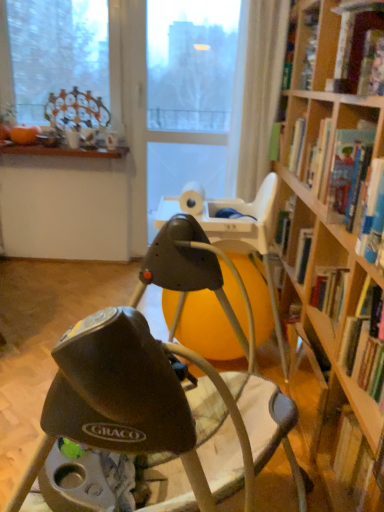
Measure the distance between transparent plastic screen door at center and camera.

2.35 meters.

Describe the element at coordinates (349, 170) in the screenshot. This screenshot has width=384, height=512. I see `hardcover book at upper right, the 2th book from the top` at that location.

Locate an element on the screen. hardcover book at right, which is the 3th book in top-to-bottom order is located at coordinates (365, 343).

This screenshot has width=384, height=512. Identify the location of the 1st book below when counting from the transparent plastic screen door at center (from the image's perspective). (354, 40).

Looking at this image, between transparent plastic screen door at center and hardcover book at upper right, which is counted as the 3th book, starting from the bottom, which one appears on the left side from the viewer's perspective?

transparent plastic screen door at center is more to the left.

In the scene shown: Between transparent plastic screen door at center and hardcover book at upper right, which is counted as the 3th book, starting from the bottom, which one has smaller width?

transparent plastic screen door at center is thinner.

Who is smaller, matte black baby swing at center or hardcover book at right, which is the first book from bottom to top?

With smaller size is hardcover book at right, which is the first book from bottom to top.

Where is `the 2nd book to the right when counting from the matte black baby swing at center`? The width and height of the screenshot is (384, 512). the 2nd book to the right when counting from the matte black baby swing at center is located at coordinates (365, 343).

From the image's perspective, is matte black baby swing at center positioned above or below hardcover book at right, which is the 3th book in top-to-bottom order?

matte black baby swing at center is situated lower than hardcover book at right, which is the 3th book in top-to-bottom order, in the image.

From a real-world perspective, which object stands above the other?

hardcover book at upper right, the 2th book from the top, is physically above.

Is hardcover book at right, which is the 3th book in top-to-bottom order, wider than hardcover book at upper right, arranged as the second book when ordered from the bottom?

No.

From the image's perspective, would you say hardcover book at right, which is the first book from bottom to top, is positioned over hardcover book at upper right, arranged as the second book when ordered from the bottom?

No, from the image's perspective, hardcover book at right, which is the first book from bottom to top, is not above hardcover book at upper right, arranged as the second book when ordered from the bottom.

Is hardcover book at right, which is the first book from bottom to top, facing away from hardcover book at upper right, the 2th book from the top?

hardcover book at right, which is the first book from bottom to top, is not turned away from hardcover book at upper right, the 2th book from the top.

Which object is wider, transparent plastic screen door at center or matte black baby swing at center?

matte black baby swing at center is wider.

From the image's perspective, would you say transparent plastic screen door at center is positioned over matte black baby swing at center?

Correct, transparent plastic screen door at center appears higher than matte black baby swing at center in the image.

Based on the photo, would you say transparent plastic screen door at center is inside or outside matte black baby swing at center?

transparent plastic screen door at center exists outside the volume of matte black baby swing at center.

From the image's perspective, is hardcover book at upper right, the 1th book in the top-to-bottom sequence, located above or below transparent plastic screen door at center?

From the image's perspective, hardcover book at upper right, the 1th book in the top-to-bottom sequence, appears below transparent plastic screen door at center.

Which object is thinner, hardcover book at upper right, which is counted as the 3th book, starting from the bottom, or transparent plastic screen door at center?

With smaller width is transparent plastic screen door at center.

Starting from the transparent plastic screen door at center, which book is the 3rd one to the right? Please provide its 2D coordinates.

[(354, 40)]

Considering the sizes of objects hardcover book at upper right, the 1th book in the top-to-bottom sequence, and transparent plastic screen door at center in the image provided, who is smaller, hardcover book at upper right, the 1th book in the top-to-bottom sequence, or transparent plastic screen door at center?

With smaller size is hardcover book at upper right, the 1th book in the top-to-bottom sequence.

Is transparent plastic screen door at center located outside hardcover book at right, which is the first book from bottom to top?

Yes, transparent plastic screen door at center is located beyond the bounds of hardcover book at right, which is the first book from bottom to top.

Considering the relative sizes of transparent plastic screen door at center and hardcover book at right, which is the 3th book in top-to-bottom order, in the image provided, is transparent plastic screen door at center wider than hardcover book at right, which is the 3th book in top-to-bottom order,?

Incorrect, the width of transparent plastic screen door at center does not surpass that of hardcover book at right, which is the 3th book in top-to-bottom order.

Is transparent plastic screen door at center to the right of hardcover book at right, which is the first book from bottom to top, from the viewer's perspective?

In fact, transparent plastic screen door at center is to the left of hardcover book at right, which is the first book from bottom to top.

Is transparent plastic screen door at center positioned with its back to hardcover book at right, which is the 3th book in top-to-bottom order?

No, transparent plastic screen door at center is not facing away from hardcover book at right, which is the 3th book in top-to-bottom order.

This screenshot has height=512, width=384. Identify the location of book that is the 1st object to the right of the matte black baby swing at center, starting at the anchor. (349, 170).

Between matte black baby swing at center and hardcover book at upper right, arranged as the second book when ordered from the bottom, which one appears on the right side from the viewer's perspective?

hardcover book at upper right, arranged as the second book when ordered from the bottom.

Which object is wider, matte black baby swing at center or hardcover book at upper right, the 2th book from the top?

With larger width is matte black baby swing at center.

Between point (201, 380) and point (362, 135), which one is positioned in front?

Positioned in front is point (362, 135).

At what (x,y) coordinates should I click in order to perform the action: click on the 3rd book to the right when counting from the transparent plastic screen door at center. Please return your answer as a coordinate pair (x, y). Looking at the image, I should click on (354, 40).

This screenshot has height=512, width=384. I want to click on chair on the left side of hardcover book at right, which is the 3th book in top-to-bottom order, so click(x=159, y=414).

Considering their positions, is matte black baby swing at center positioned further to hardcover book at right, which is the first book from bottom to top, than hardcover book at upper right, which is counted as the 3th book, starting from the bottom?

The object further to hardcover book at right, which is the first book from bottom to top, is hardcover book at upper right, which is counted as the 3th book, starting from the bottom.

Looking at the image, which one is located further to hardcover book at right, which is the first book from bottom to top, hardcover book at upper right, which is counted as the 3th book, starting from the bottom, or transparent plastic screen door at center?

transparent plastic screen door at center is further to hardcover book at right, which is the first book from bottom to top.

Based on their spatial positions, is hardcover book at right, which is the 3th book in top-to-bottom order, or hardcover book at upper right, which is counted as the 3th book, starting from the bottom, further from hardcover book at upper right, the 2th book from the top?

hardcover book at right, which is the 3th book in top-to-bottom order, is positioned further to the anchor hardcover book at upper right, the 2th book from the top.

Looking at this image, when comparing their distances from matte black baby swing at center, does transparent plastic screen door at center or hardcover book at right, which is the first book from bottom to top, seem closer?

hardcover book at right, which is the first book from bottom to top, lies closer to matte black baby swing at center than the other object.

Looking at the image, which one is located closer to transparent plastic screen door at center, matte black baby swing at center or hardcover book at right, which is the 3th book in top-to-bottom order?

hardcover book at right, which is the 3th book in top-to-bottom order, lies closer to transparent plastic screen door at center than the other object.

When comparing their distances from hardcover book at upper right, the 1th book in the top-to-bottom sequence, does hardcover book at right, which is the 3th book in top-to-bottom order, or transparent plastic screen door at center seem further?

transparent plastic screen door at center is further to hardcover book at upper right, the 1th book in the top-to-bottom sequence.

Looking at the image, which one is located closer to hardcover book at upper right, arranged as the second book when ordered from the bottom, hardcover book at upper right, the 1th book in the top-to-bottom sequence, or hardcover book at right, which is the 3th book in top-to-bottom order?

hardcover book at upper right, the 1th book in the top-to-bottom sequence, lies closer to hardcover book at upper right, arranged as the second book when ordered from the bottom, than the other object.

From the image, which object appears to be farther from matte black baby swing at center, hardcover book at upper right, arranged as the second book when ordered from the bottom, or hardcover book at upper right, the 1th book in the top-to-bottom sequence?

hardcover book at upper right, the 1th book in the top-to-bottom sequence.

Find the location of a particular element. The image size is (384, 512). book between hardcover book at upper right, which is counted as the 3th book, starting from the bottom, and hardcover book at right, which is the first book from bottom to top, from top to bottom is located at coordinates (349, 170).

In order to click on book between hardcover book at upper right, the 1th book in the top-to-bottom sequence, and transparent plastic screen door at center in the front-back direction in this screenshot , I will do pos(349,170).